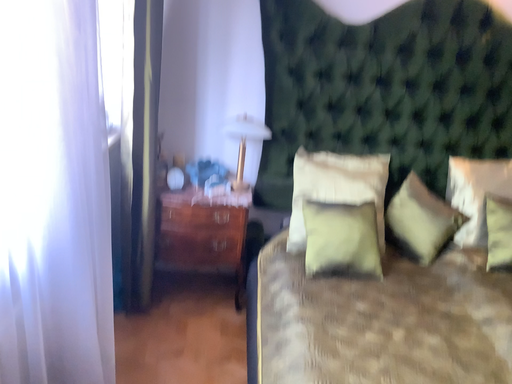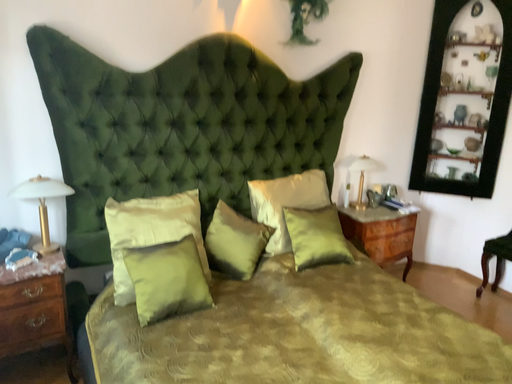
Question: Which way did the camera rotate in the video?

Choices:
 (A) rotated left
 (B) rotated right

Answer: (B)